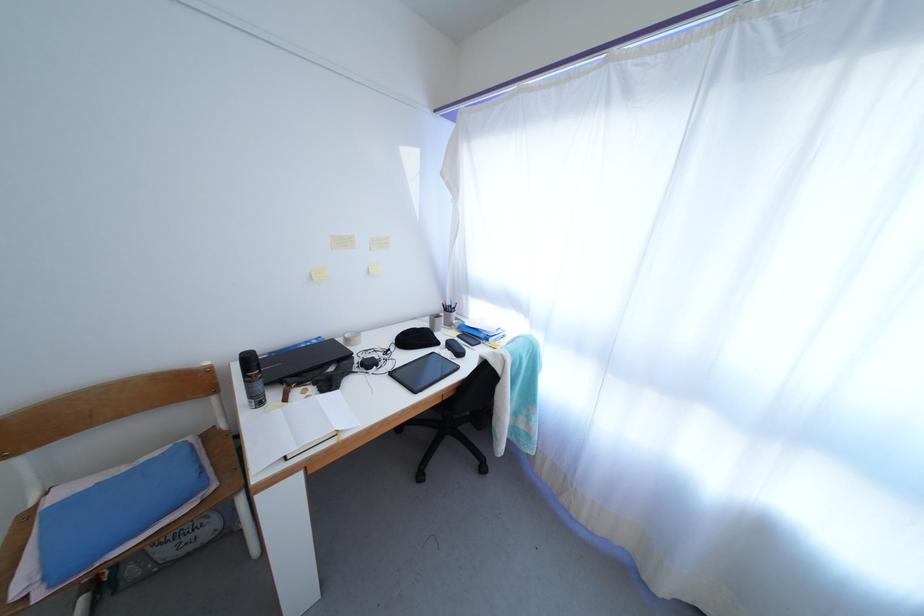
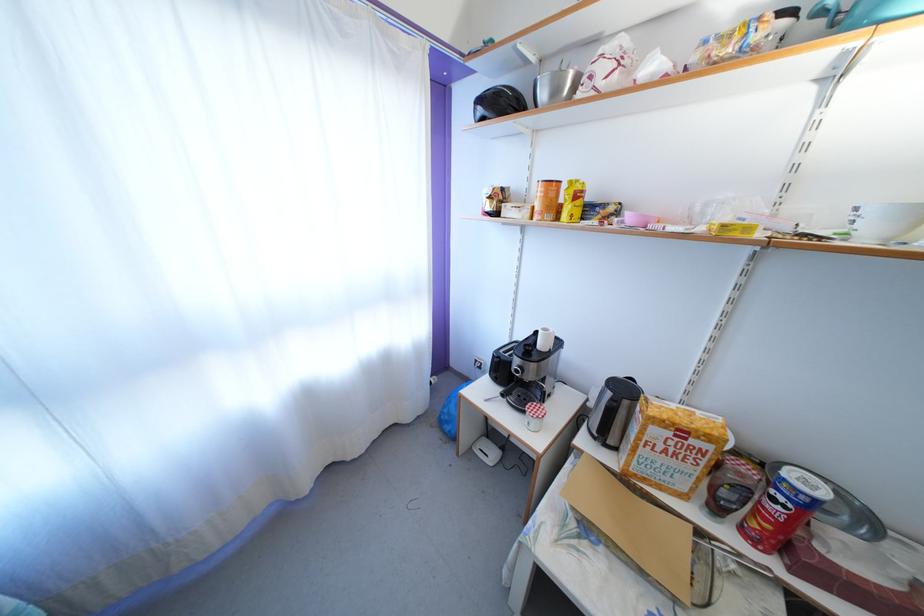
How did the camera likely rotate?

The rotation direction of the camera is right-down.